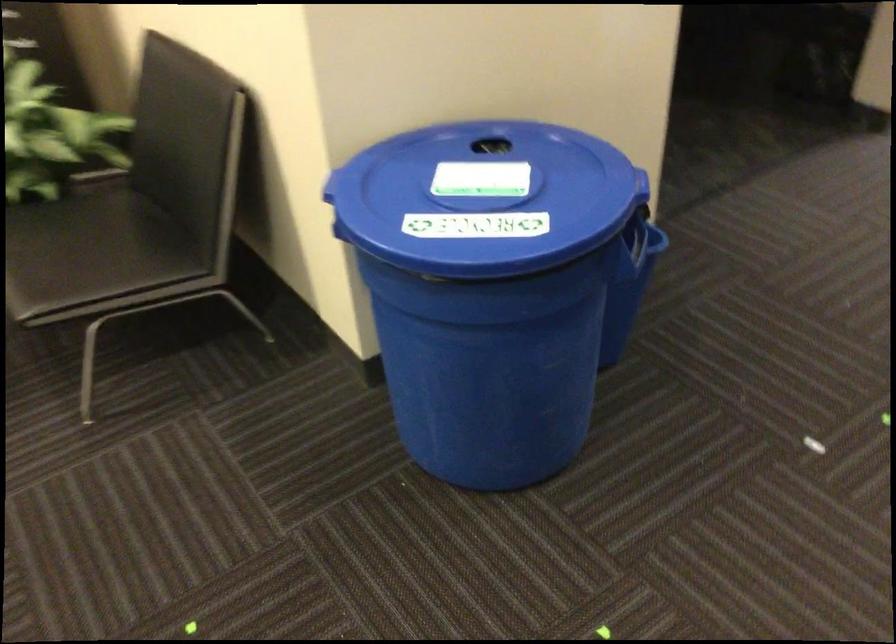
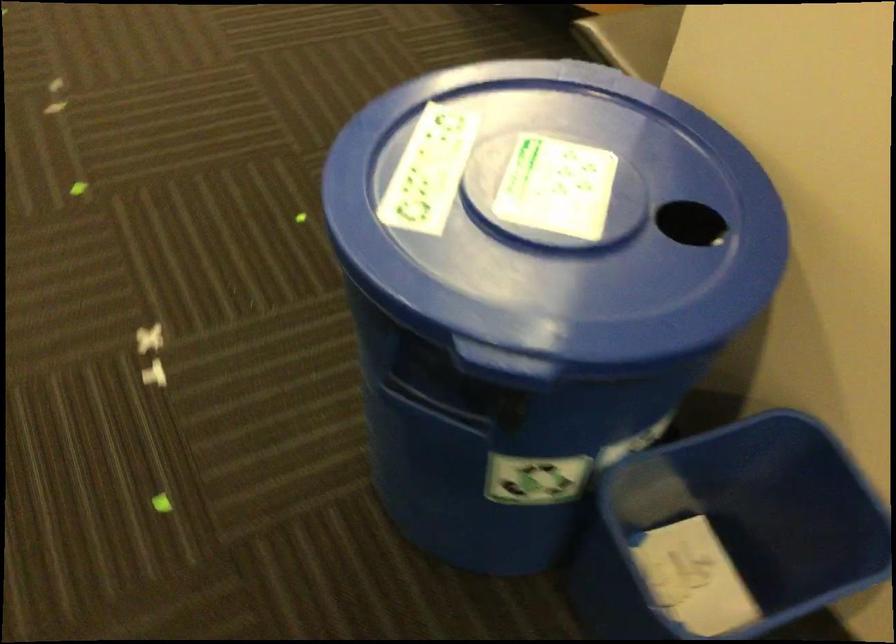
Locate, in the second image, the point that corresponds to pixel 511 174 in the first image.

(561, 220)